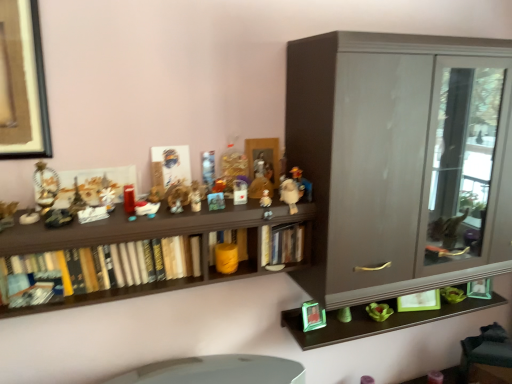
Question: Is metallic silver toy at center, which is the sixth toy from left to right, at the left side of white plastic toy at center, which ranks as the 9th toy in left-to-right order?

Choices:
 (A) yes
 (B) no

Answer: (A)

Question: Can you confirm if metallic silver toy at center, which is the sixth toy from left to right, is positioned to the right of white plastic toy at center, which ranks as the 9th toy in left-to-right order?

Choices:
 (A) no
 (B) yes

Answer: (A)

Question: Is the position of metallic silver toy at center, the 7th toy viewed from the right, less distant than that of white plastic toy at center, which ranks as the 9th toy in left-to-right order?

Choices:
 (A) yes
 (B) no

Answer: (B)

Question: Does metallic silver toy at center, the 7th toy viewed from the right, touch white plastic toy at center, marked as the 4th toy in a right-to-left arrangement?

Choices:
 (A) no
 (B) yes

Answer: (A)

Question: Considering the relative sizes of metallic silver toy at center, which is the sixth toy from left to right, and white plastic toy at center, which ranks as the 9th toy in left-to-right order, in the image provided, is metallic silver toy at center, which is the sixth toy from left to right, wider than white plastic toy at center, which ranks as the 9th toy in left-to-right order,?

Choices:
 (A) no
 (B) yes

Answer: (A)

Question: Which is correct: hardcover books at center left, the 3th book from the right, is inside green plastic frame at lower right, acting as the 2th toy starting from the right, or outside of it?

Choices:
 (A) inside
 (B) outside

Answer: (B)

Question: Based on their positions, is hardcover books at center left, the 1th book in the left-to-right sequence, located to the left or right of green plastic frame at lower right, acting as the 2th toy starting from the right?

Choices:
 (A) left
 (B) right

Answer: (A)

Question: Looking at their shapes, would you say hardcover books at center left, the 3th book from the right, is wider or thinner than green plastic frame at lower right, the 11th toy when ordered from left to right?

Choices:
 (A) thin
 (B) wide

Answer: (B)

Question: Based on their sizes in the image, would you say hardcover books at center left, the 3th book from the right, is bigger or smaller than green plastic frame at lower right, acting as the 2th toy starting from the right?

Choices:
 (A) small
 (B) big

Answer: (B)

Question: Looking at the image, does brown wooden shelf at upper center seem bigger or smaller compared to white plastic toy at center, which ranks as the 9th toy in left-to-right order?

Choices:
 (A) big
 (B) small

Answer: (A)

Question: Is brown wooden shelf at upper center to the left or to the right of white plastic toy at center, marked as the 4th toy in a right-to-left arrangement, in the image?

Choices:
 (A) right
 (B) left

Answer: (A)

Question: Is point (194, 8) positioned closer to the camera than point (245, 198)?

Choices:
 (A) closer
 (B) farther

Answer: (B)

Question: In the image, is brown wooden shelf at upper center positioned in front of or behind white plastic toy at center, marked as the 4th toy in a right-to-left arrangement?

Choices:
 (A) behind
 (B) front

Answer: (B)

Question: Is yellow matte bookshelf at center, positioned as the 2th book in left-to-right order, taller or shorter than metallic silver toy at center, placed as the 11th toy when sorted from right to left?

Choices:
 (A) short
 (B) tall

Answer: (B)

Question: From the image's perspective, is yellow matte bookshelf at center, positioned as the 2th book in left-to-right order, located above or below metallic silver toy at center, placed as the 11th toy when sorted from right to left?

Choices:
 (A) below
 (B) above

Answer: (A)